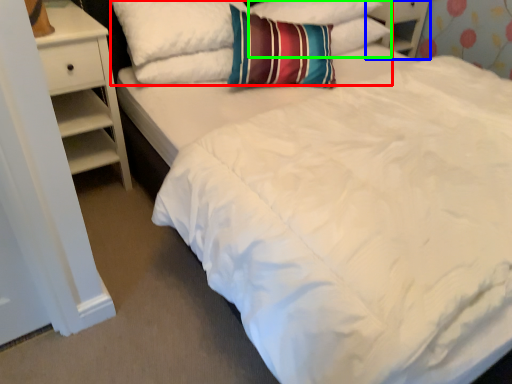
Question: Considering the real-world distances, which object is farthest from pillow (highlighted by a red box)? dresser (highlighted by a blue box) or pillow (highlighted by a green box)?

Choices:
 (A) dresser
 (B) pillow

Answer: (A)